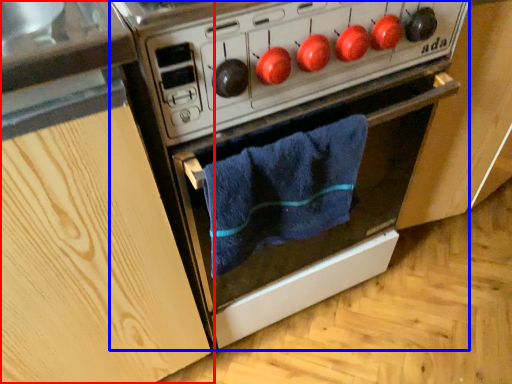
Question: Which object is further to the camera taking this photo, cabinetry (highlighted by a red box) or oven (highlighted by a blue box)?

Choices:
 (A) cabinetry
 (B) oven

Answer: (B)